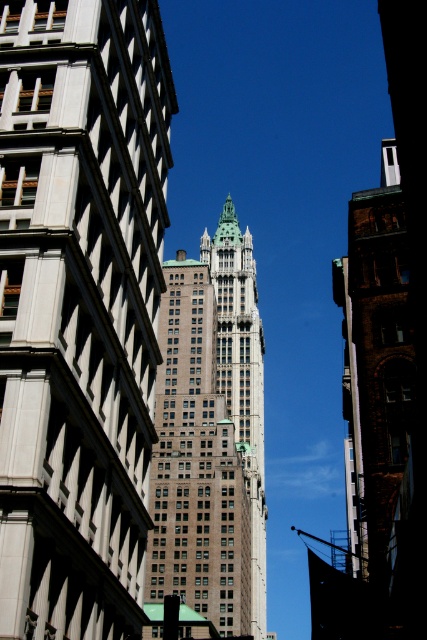
Can you confirm if white stone skyscraper at center is taller than green stone tower at center?

No.

Can you confirm if white stone skyscraper at center is smaller than green stone tower at center?

Correct, white stone skyscraper at center occupies less space than green stone tower at center.

You are a GUI agent. You are given a task and a screenshot of the screen. Output one action in this format:
    pyautogui.click(x=<x>, y=<y>)
    Task: Click on the white stone skyscraper at center
    This screenshot has width=427, height=640.
    Given the screenshot: What is the action you would take?
    pyautogui.click(x=78, y=308)

Where is `white stone skyscraper at center`? The width and height of the screenshot is (427, 640). white stone skyscraper at center is located at coordinates (78, 308).

Does point (17, 228) lie behind point (216, 520)?

No, (17, 228) is closer to viewer.

Based on the photo, can you confirm if white stone skyscraper at center is wider than brown stone building at center?

No, white stone skyscraper at center is not wider than brown stone building at center.

Locate an element on the screen. This screenshot has height=640, width=427. white stone skyscraper at center is located at coordinates (78, 308).

In order to click on white stone skyscraper at center in this screenshot , I will do `click(78, 308)`.

The height and width of the screenshot is (640, 427). What do you see at coordinates (196, 461) in the screenshot?
I see `brown stone building at center` at bounding box center [196, 461].

The width and height of the screenshot is (427, 640). What do you see at coordinates (196, 461) in the screenshot?
I see `brown stone building at center` at bounding box center [196, 461].

The image size is (427, 640). I want to click on brown stone building at center, so click(x=196, y=461).